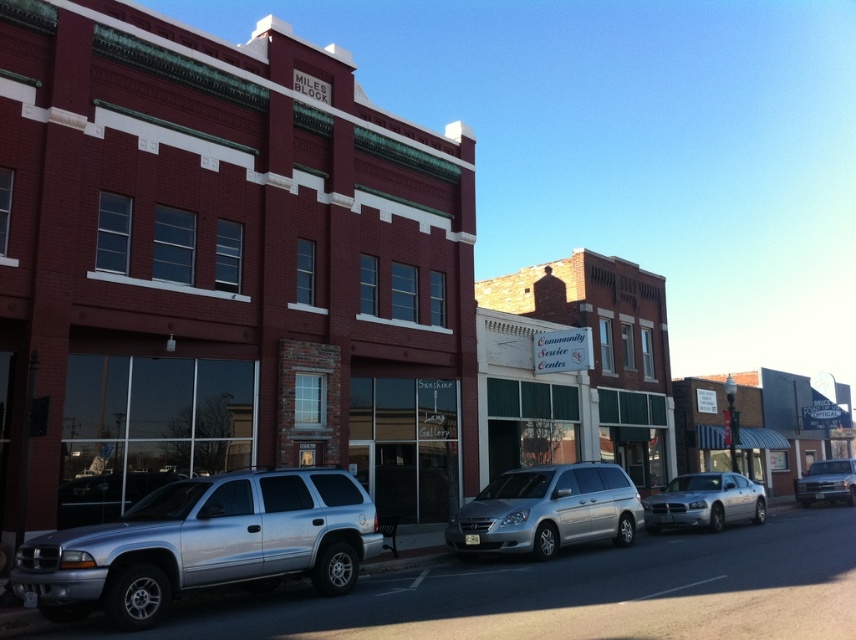
Can you confirm if silver metallic sedan at center is taller than silver metallic truck at right?

No.

Is silver metallic sedan at center smaller than silver metallic truck at right?

Indeed, silver metallic sedan at center has a smaller size compared to silver metallic truck at right.

Does point (682, 515) come behind point (816, 477)?

No, (682, 515) is in front of (816, 477).

Locate an element on the screen. silver metallic sedan at center is located at coordinates (704, 500).

Is silver metallic suv at left shorter than silver metallic minivan at center?

No.

Between silver metallic suv at left and silver metallic minivan at center, which one appears on the left side from the viewer's perspective?

silver metallic suv at left

Which is behind, point (330, 595) or point (607, 529)?

The point (607, 529) is more distant.

Where is `silver metallic suv at left`? Image resolution: width=856 pixels, height=640 pixels. silver metallic suv at left is located at coordinates coord(201,545).

The height and width of the screenshot is (640, 856). What are the coordinates of `silver metallic minivan at center` in the screenshot? It's located at (547, 509).

Can you confirm if silver metallic minivan at center is taller than silver metallic sedan at center?

No, silver metallic minivan at center is not taller than silver metallic sedan at center.

What do you see at coordinates (547, 509) in the screenshot? I see `silver metallic minivan at center` at bounding box center [547, 509].

The image size is (856, 640). What are the coordinates of `silver metallic minivan at center` in the screenshot? It's located at (547, 509).